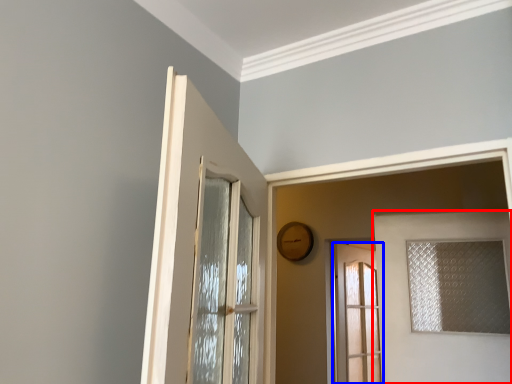
Question: Which object is closer to the camera taking this photo, door (highlighted by a red box) or door (highlighted by a blue box)?

Choices:
 (A) door
 (B) door

Answer: (A)